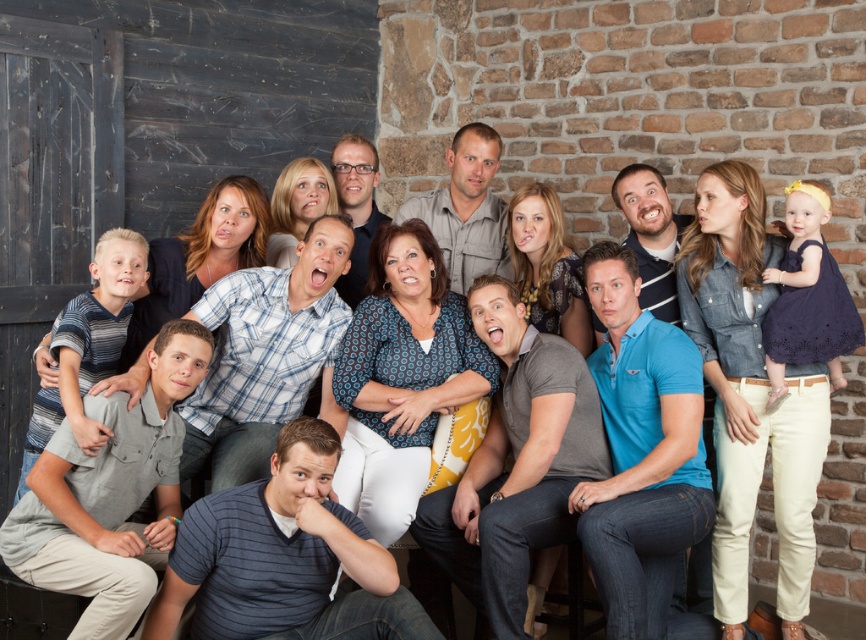
Does point (457, 180) come closer to viewer compared to point (640, 294)?

No.

The image size is (866, 640). What do you see at coordinates (466, 209) in the screenshot?
I see `light brown shirt at center` at bounding box center [466, 209].

Who is more distant from viewer, (503, 202) or (631, 195)?

The point (503, 202) is behind.

Where is `light brown shirt at center`? This screenshot has width=866, height=640. light brown shirt at center is located at coordinates (466, 209).